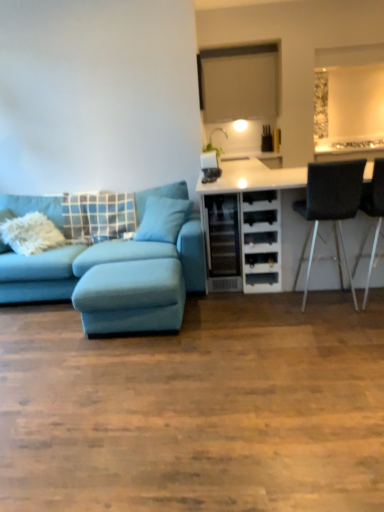
The height and width of the screenshot is (512, 384). I want to click on light blue fabric footrest at lower left, so click(131, 296).

At what (x,y) coordinates should I click in order to perform the action: click on teal fabric pillow at center, the 1th pillow when ordered from right to left. Please return your answer as a coordinate pair (x, y). Looking at the image, I should click on (163, 219).

The image size is (384, 512). What do you see at coordinates (250, 180) in the screenshot?
I see `white matte cabinet at right` at bounding box center [250, 180].

How much space does metallic silver chair at right, positioned as the second chair in left-to-right order, occupy horizontally?

It is 52.58 centimeters.

Where is `blue fabric pillow at left, which is the second pillow from right to left`? The width and height of the screenshot is (384, 512). blue fabric pillow at left, which is the second pillow from right to left is located at coordinates (98, 216).

Considering the relative positions of blue fabric pillow at left, acting as the first pillow starting from the left, and teal fabric pillow at center, the 1th pillow when ordered from right to left, in the image provided, is blue fabric pillow at left, acting as the first pillow starting from the left, behind teal fabric pillow at center, the 1th pillow when ordered from right to left,?

Yes, it is.

From a real-world perspective, is blue fabric pillow at left, which is the second pillow from right to left, positioned under teal fabric pillow at center, the 1th pillow when ordered from right to left, based on gravity?

No, from a real-world perspective, blue fabric pillow at left, which is the second pillow from right to left, is not below teal fabric pillow at center, the 1th pillow when ordered from right to left.

Does blue fabric pillow at left, which is the second pillow from right to left, have a greater width compared to teal fabric pillow at center, which is the 2th pillow in left-to-right order?

No, blue fabric pillow at left, which is the second pillow from right to left, is not wider than teal fabric pillow at center, which is the 2th pillow in left-to-right order.

Do you think blue fabric pillow at left, which is the second pillow from right to left, is within teal fabric pillow at center, which is the 2th pillow in left-to-right order, or outside of it?

blue fabric pillow at left, which is the second pillow from right to left, is outside teal fabric pillow at center, which is the 2th pillow in left-to-right order.

Is blue fabric pillow at left, which is the second pillow from right to left, thinner than velvet teal couch at left?

Correct, the width of blue fabric pillow at left, which is the second pillow from right to left, is less than that of velvet teal couch at left.

Image resolution: width=384 pixels, height=512 pixels. Identify the location of studio couch on the left of blue fabric pillow at left, which is the second pillow from right to left. (113, 281).

Choose the correct answer: Is blue fabric pillow at left, acting as the first pillow starting from the left, inside velvet teal couch at left or outside it?

blue fabric pillow at left, acting as the first pillow starting from the left, is enclosed within velvet teal couch at left.

From the picture: In the image, is blue fabric pillow at left, acting as the first pillow starting from the left, positioned in front of or behind velvet teal couch at left?

blue fabric pillow at left, acting as the first pillow starting from the left, is behind velvet teal couch at left.

Is blue fabric pillow at left, acting as the first pillow starting from the left, smaller than light blue fabric footrest at lower left?

No, blue fabric pillow at left, acting as the first pillow starting from the left, is not smaller than light blue fabric footrest at lower left.

From the picture: Which is closer, (117, 225) or (105, 297)?

The point (105, 297) is closer to the camera.

Which object is further away from the camera taking this photo, blue fabric pillow at left, acting as the first pillow starting from the left, or light blue fabric footrest at lower left?

blue fabric pillow at left, acting as the first pillow starting from the left.

Is velvet teal couch at left thinner than light blue fabric footrest at lower left?

Incorrect, the width of velvet teal couch at left is not less than that of light blue fabric footrest at lower left.

Between velvet teal couch at left and light blue fabric footrest at lower left, which one is positioned in front?

Positioned in front is velvet teal couch at left.

How much distance is there between velvet teal couch at left and light blue fabric footrest at lower left?

They are 5.28 inches apart.

Is velvet teal couch at left spatially inside metallic silver chair at right, the first chair positioned from the right, or outside of it?

The correct answer is: outside.

Would you consider velvet teal couch at left to be distant from metallic silver chair at right, the first chair positioned from the right?

Yes, velvet teal couch at left and metallic silver chair at right, the first chair positioned from the right, are quite far apart.

Which point is more distant from viewer, [189,252] or [366,292]?

The point [189,252] is farther from the camera.

What's the angular difference between velvet teal couch at left and metallic silver chair at right, positioned as the second chair in left-to-right order,'s facing directions?

176 degrees.

Is white matte cabinet at right oriented towards teal fabric pillow at center, which is the 2th pillow in left-to-right order?

No, white matte cabinet at right is not oriented towards teal fabric pillow at center, which is the 2th pillow in left-to-right order.

From a real-world perspective, between white matte cabinet at right and teal fabric pillow at center, the 1th pillow when ordered from right to left, who is vertically higher?

In real-world perspective, teal fabric pillow at center, the 1th pillow when ordered from right to left, is above.

Would you say white matte cabinet at right is a long distance from teal fabric pillow at center, the 1th pillow when ordered from right to left?

No, white matte cabinet at right is not far away from teal fabric pillow at center, the 1th pillow when ordered from right to left.

Consider the image. From the image's perspective, is white matte cabinet at right below teal fabric pillow at center, the 1th pillow when ordered from right to left?

Indeed, from the image's perspective, white matte cabinet at right is shown beneath teal fabric pillow at center, the 1th pillow when ordered from right to left.

Is light blue fabric footrest at lower left inside the boundaries of white matte cabinet at right, or outside?

light blue fabric footrest at lower left is not enclosed by white matte cabinet at right.

Considering the sizes of objects light blue fabric footrest at lower left and white matte cabinet at right in the image provided, who is wider, light blue fabric footrest at lower left or white matte cabinet at right?

white matte cabinet at right is wider.

Is light blue fabric footrest at lower left oriented towards white matte cabinet at right?

No, light blue fabric footrest at lower left is not aimed at white matte cabinet at right.

Does point (110, 307) lie behind point (263, 176)?

No, it is in front of (263, 176).

Find the location of a particular element. pillow that is on the left side of teal fabric pillow at center, the 1th pillow when ordered from right to left is located at coordinates (98, 216).

The width and height of the screenshot is (384, 512). Identify the location of the 2nd pillow positioned above the velvet teal couch at left (from a real-world perspective). (98, 216).

Considering their positions, is teal fabric pillow at center, the 1th pillow when ordered from right to left, positioned closer to white matte cabinet at right than black leather chair at right, which is the 1th chair in left-to-right order?

black leather chair at right, which is the 1th chair in left-to-right order, is positioned closer to the anchor white matte cabinet at right.

When comparing their distances from metallic silver chair at right, the first chair positioned from the right, does blue fabric pillow at left, acting as the first pillow starting from the left, or velvet teal couch at left seem further?

blue fabric pillow at left, acting as the first pillow starting from the left, is positioned further to the anchor metallic silver chair at right, the first chair positioned from the right.

Looking at the image, which one is located further to blue fabric pillow at left, which is the second pillow from right to left, white matte cabinet at right or metallic silver chair at right, positioned as the second chair in left-to-right order?

metallic silver chair at right, positioned as the second chair in left-to-right order.

Estimate the real-world distances between objects in this image. Which object is further from black leather chair at right, which is the 2th chair in right-to-left order, white matte cabinet at right or teal fabric pillow at center, the 1th pillow when ordered from right to left?

teal fabric pillow at center, the 1th pillow when ordered from right to left.

Which object lies nearer to the anchor point blue fabric pillow at left, which is the second pillow from right to left, black leather chair at right, which is the 1th chair in left-to-right order, or metallic silver chair at right, positioned as the second chair in left-to-right order?

black leather chair at right, which is the 1th chair in left-to-right order.

Estimate the real-world distances between objects in this image. Which object is closer to teal fabric pillow at center, which is the 2th pillow in left-to-right order, metallic silver chair at right, the first chair positioned from the right, or white matte cabinet at right?

Among the two, white matte cabinet at right is located nearer to teal fabric pillow at center, which is the 2th pillow in left-to-right order.

Based on their spatial positions, is metallic silver chair at right, positioned as the second chair in left-to-right order, or velvet teal couch at left closer to blue fabric pillow at left, which is the second pillow from right to left?

velvet teal couch at left is positioned closer to the anchor blue fabric pillow at left, which is the second pillow from right to left.

Consider the image. Based on their spatial positions, is teal fabric pillow at center, the 1th pillow when ordered from right to left, or metallic silver chair at right, the first chair positioned from the right, closer to black leather chair at right, which is the 1th chair in left-to-right order?

Based on the image, metallic silver chair at right, the first chair positioned from the right, appears to be nearer to black leather chair at right, which is the 1th chair in left-to-right order.

Find the location of a particular element. pillow positioned between light blue fabric footrest at lower left and blue fabric pillow at left, which is the second pillow from right to left, from near to far is located at coordinates (163, 219).

Where is `chair between teal fabric pillow at center, the 1th pillow when ordered from right to left, and metallic silver chair at right, the first chair positioned from the right`? Image resolution: width=384 pixels, height=512 pixels. chair between teal fabric pillow at center, the 1th pillow when ordered from right to left, and metallic silver chair at right, the first chair positioned from the right is located at coordinates (330, 208).

The width and height of the screenshot is (384, 512). I want to click on cabinetry between velvet teal couch at left and metallic silver chair at right, positioned as the second chair in left-to-right order, in the horizontal direction, so click(x=250, y=180).

Find the location of `footrest between blue fabric pillow at left, which is the second pillow from right to left, and white matte cabinet at right from left to right`. footrest between blue fabric pillow at left, which is the second pillow from right to left, and white matte cabinet at right from left to right is located at coordinates (131, 296).